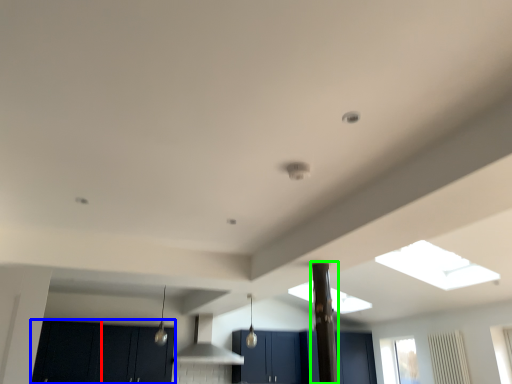
Question: Based on their relative distances, which object is nearer to cabinetry (highlighted by a red box)? Choose from cabinetry (highlighted by a blue box) and pillar (highlighted by a green box).

Choices:
 (A) cabinetry
 (B) pillar

Answer: (A)